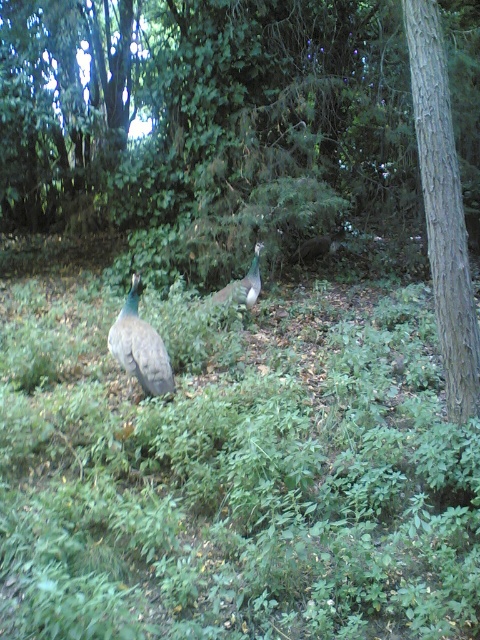
Question: From the image, what is the correct spatial relationship of green leafy grass at center in relation to green iridescent peacock at center?

Choices:
 (A) right
 (B) left

Answer: (A)

Question: Does green leafy grass at center appear on the left side of brown textured tree at center right?

Choices:
 (A) no
 (B) yes

Answer: (A)

Question: Which of the following is the farthest from the observer?

Choices:
 (A) brown textured tree at center right
 (B) green iridescent peacock at center

Answer: (B)

Question: Which object is the farthest from the brown rough tree trunk at right?

Choices:
 (A) shiny green peacock at center
 (B) brown textured tree at center right
 (C) green iridescent peacock at center

Answer: (B)

Question: Among these points, which one is nearest to the camera?

Choices:
 (A) (95, 481)
 (B) (243, 84)
 (C) (432, 115)
 (D) (157, 349)

Answer: (A)

Question: Is brown textured tree at center right closer to the viewer compared to shiny green peacock at center?

Choices:
 (A) yes
 (B) no

Answer: (A)